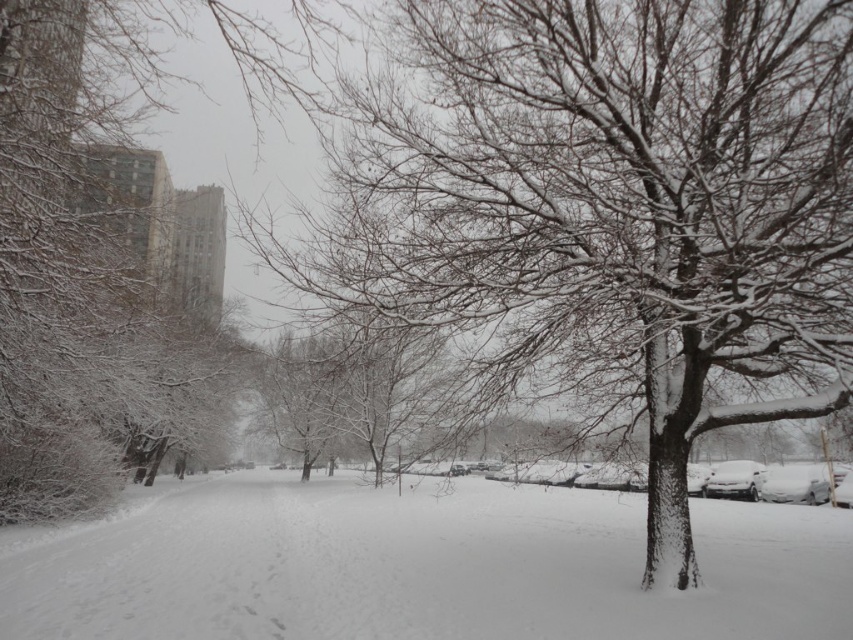
You are standing at the point marked as point [606,208] in the image. What object is located exactly at that point?

The point [606,208] is occupied by a snow covered tree at center.